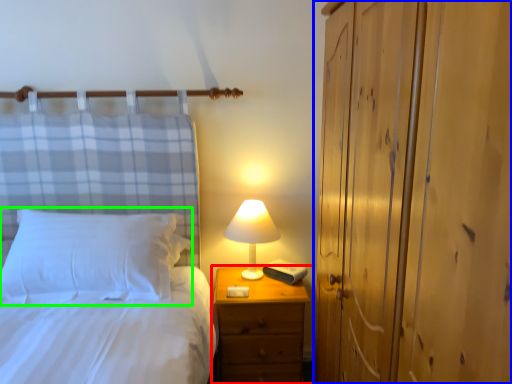
Question: Estimate the real-world distances between objects in this image. Which object is farther from nightstand (highlighted by a red box), dresser (highlighted by a blue box) or pillow (highlighted by a green box)?

Choices:
 (A) dresser
 (B) pillow

Answer: (A)